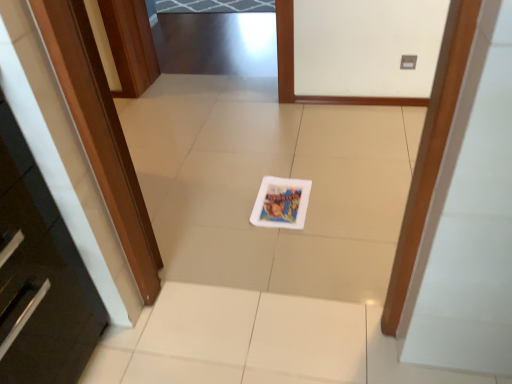
Locate an element on the screen. wooden door at left is located at coordinates (100, 133).

Image resolution: width=512 pixels, height=384 pixels. Describe the element at coordinates (100, 133) in the screenshot. I see `wooden door at left` at that location.

The width and height of the screenshot is (512, 384). What do you see at coordinates (281, 203) in the screenshot?
I see `white glossy postcard at center` at bounding box center [281, 203].

This screenshot has height=384, width=512. In order to click on white glossy postcard at center in this screenshot , I will do click(281, 203).

Where is `wooden door at left`? The width and height of the screenshot is (512, 384). wooden door at left is located at coordinates (100, 133).

Does wooden door at left appear on the left side of white glossy postcard at center?

Yes, wooden door at left is to the left of white glossy postcard at center.

Based on the photo, relative to white glossy postcard at center, is wooden door at left in front or behind?

wooden door at left is in front of white glossy postcard at center.

Is point (123, 204) less distant than point (286, 186)?

Yes, it is in front of point (286, 186).

In the scene shown: From the image's perspective, which one is positioned higher, wooden door at left or white glossy postcard at center?

wooden door at left, from the image's perspective.

From a real-world perspective, relative to white glossy postcard at center, is wooden door at left vertically above or below?

wooden door at left is situated higher than white glossy postcard at center in the real world.

Does wooden door at left have a lesser width compared to white glossy postcard at center?

Indeed, wooden door at left has a lesser width compared to white glossy postcard at center.

In terms of height, does wooden door at left look taller or shorter compared to white glossy postcard at center?

Clearly, wooden door at left is taller compared to white glossy postcard at center.

Is wooden door at left bigger or smaller than white glossy postcard at center?

Clearly, wooden door at left is larger in size than white glossy postcard at center.

Is wooden door at left surrounding white glossy postcard at center?

That's incorrect, white glossy postcard at center is not inside wooden door at left.

Are wooden door at left and white glossy postcard at center beside each other?

No, wooden door at left is not in contact with white glossy postcard at center.

Could you tell me if wooden door at left is facing white glossy postcard at center?

Yes, wooden door at left is turned towards white glossy postcard at center.

How far apart are wooden door at left and white glossy postcard at center?

wooden door at left and white glossy postcard at center are 60.57 centimeters apart from each other.

At what (x,y) coordinates should I click in order to perform the action: click on postcard below the wooden door at left (from a real-world perspective). Please return your answer as a coordinate pair (x, y). The height and width of the screenshot is (384, 512). Looking at the image, I should click on [x=281, y=203].

Based on their positions, is white glossy postcard at center located to the left or right of wooden door at left?

In the image, white glossy postcard at center appears on the right side of wooden door at left.

Which is behind, white glossy postcard at center or wooden door at left?

white glossy postcard at center is behind.

Between point (285, 224) and point (149, 256), which one is positioned behind?

The point (285, 224) is more distant.

From the image's perspective, would you say white glossy postcard at center is positioned over wooden door at left?

Incorrect, from the image's perspective, white glossy postcard at center is lower than wooden door at left.

From a real-world perspective, is white glossy postcard at center on wooden door at left?

Incorrect, from a real-world perspective, white glossy postcard at center is lower than wooden door at left.

Does white glossy postcard at center have a greater width compared to wooden door at left?

Correct, the width of white glossy postcard at center exceeds that of wooden door at left.

Can you confirm if white glossy postcard at center is taller than wooden door at left?

Incorrect, the height of white glossy postcard at center is not larger of that of wooden door at left.

Between white glossy postcard at center and wooden door at left, which one has larger size?

Bigger between the two is wooden door at left.

From the picture: Does white glossy postcard at center contain wooden door at left?

No, wooden door at left is not a part of white glossy postcard at center.

Are white glossy postcard at center and wooden door at left located far from each other?

Actually, white glossy postcard at center and wooden door at left are a little close together.

Is white glossy postcard at center positioned with its back to wooden door at left?

white glossy postcard at center is not turned away from wooden door at left.

Consider the image. Can you tell me how much white glossy postcard at center and wooden door at left differ in facing direction?

The angle between the facing direction of white glossy postcard at center and the facing direction of wooden door at left is 129 degrees.

Where is `door in front of the white glossy postcard at center`? This screenshot has width=512, height=384. door in front of the white glossy postcard at center is located at coordinates (100, 133).

Locate an element on the screen. The height and width of the screenshot is (384, 512). door that is in front of the white glossy postcard at center is located at coordinates (100, 133).

In the image, there is a wooden door at left. Identify the location of postcard below it (from a real-world perspective). (281, 203).